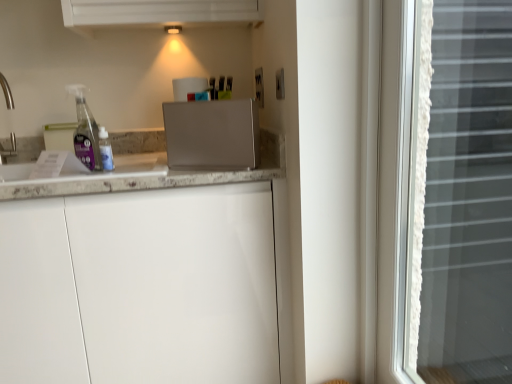
What do you see at coordinates (133, 176) in the screenshot?
I see `white marble countertop at left` at bounding box center [133, 176].

This screenshot has width=512, height=384. Describe the element at coordinates (140, 287) in the screenshot. I see `white matte cabinet at center` at that location.

Measure the distance between point (169, 236) and camera.

Point (169, 236) is 4.13 feet away from camera.

This screenshot has height=384, width=512. Identify the location of satin silver toaster at center. pyautogui.click(x=212, y=134).

Locate an element on the screen. countertop that is above the white matte cabinet at center (from the image's perspective) is located at coordinates (133, 176).

Is white matte cabinet at center not inside white marble countertop at left?

white matte cabinet at center lies outside white marble countertop at left's area.

Does point (272, 341) appear closer or farther from the camera than point (268, 173)?

Point (272, 341) appears to be farther away from the viewer than point (268, 173).

Which is behind, white matte cabinet at center or white marble countertop at left?

white marble countertop at left.

From a real-world perspective, is white lace curtain at right below white marble countertop at left?

Yes, from a real-world perspective, white lace curtain at right is under white marble countertop at left.

How many degrees apart are the facing directions of white lace curtain at right and white marble countertop at left?

They differ by 89.7 degrees in their facing directions.

Find the location of `countertop above the white lace curtain at right (from the image's perspective)`. countertop above the white lace curtain at right (from the image's perspective) is located at coordinates (133, 176).

Considering the relative positions of white lace curtain at right and white marble countertop at left in the image provided, is white lace curtain at right to the left or to the right of white marble countertop at left?

white lace curtain at right is to the right of white marble countertop at left.

Can you confirm if white matte cabinet at center is bigger than satin silver toaster at center?

Indeed, white matte cabinet at center has a larger size compared to satin silver toaster at center.

Is point (157, 284) in front of point (183, 165)?

That is True.

Is white marble countertop at left not near white lace curtain at right?

No.

From the image's perspective, is white marble countertop at left positioned above or below white lace curtain at right?

white marble countertop at left is above white lace curtain at right.

Between satin silver toaster at center and white lace curtain at right, which one has larger size?

Bigger between the two is white lace curtain at right.

Which point is more forward, (195, 110) or (442, 318)?

The point (195, 110) is in front.

Where is `window that appears below the satin silver toaster at center (from the image's perspective)`? window that appears below the satin silver toaster at center (from the image's perspective) is located at coordinates (448, 195).

Looking at this image, is white marble countertop at left facing away from white matte cabinet at center?

Yes, white marble countertop at left is facing away from white matte cabinet at center.

Is the depth of white marble countertop at left greater than that of white matte cabinet at center?

Yes, the depth of white marble countertop at left is greater than that of white matte cabinet at center.

Considering the relative sizes of white marble countertop at left and white matte cabinet at center in the image provided, is white marble countertop at left smaller than white matte cabinet at center?

Yes.

How far apart are white marble countertop at left and white matte cabinet at center?

white marble countertop at left is 10.87 inches away from white matte cabinet at center.

Who is bigger, white matte cabinet at center or white lace curtain at right?

With larger size is white matte cabinet at center.

In the scene shown: Does white matte cabinet at center touch white lace curtain at right?

No, white matte cabinet at center is not next to white lace curtain at right.

Looking at this image, measure the distance between white matte cabinet at center and white lace curtain at right.

white matte cabinet at center is 27.35 inches away from white lace curtain at right.

Does white matte cabinet at center have a greater height compared to white lace curtain at right?

Incorrect, the height of white matte cabinet at center is not larger of that of white lace curtain at right.

Identify the location of countertop behind the white matte cabinet at center. (133, 176).

Find the location of a particular element. This screenshot has height=384, width=512. countertop above the white lace curtain at right (from the image's perspective) is located at coordinates click(x=133, y=176).

Looking at the image, which one is located closer to satin silver toaster at center, white matte cabinet at center or white lace curtain at right?

white matte cabinet at center lies closer to satin silver toaster at center than the other object.

Looking at the image, which one is located closer to white marble countertop at left, white lace curtain at right or satin silver toaster at center?

Among the two, satin silver toaster at center is located nearer to white marble countertop at left.

Based on their spatial positions, is white marble countertop at left or white matte cabinet at center closer to white lace curtain at right?

white matte cabinet at center is closer to white lace curtain at right.

Considering their positions, is white marble countertop at left positioned closer to white matte cabinet at center than white lace curtain at right?

Among the two, white marble countertop at left is located nearer to white matte cabinet at center.

Based on their spatial positions, is satin silver toaster at center or white lace curtain at right further from white marble countertop at left?

white lace curtain at right lies further to white marble countertop at left than the other object.

Estimate the real-world distances between objects in this image. Which object is further from satin silver toaster at center, white lace curtain at right or white marble countertop at left?

white lace curtain at right.

Which object lies nearer to the anchor point white lace curtain at right, white matte cabinet at center or white marble countertop at left?

The object closer to white lace curtain at right is white matte cabinet at center.

Based on their spatial positions, is white marble countertop at left or satin silver toaster at center closer to white matte cabinet at center?

white marble countertop at left lies closer to white matte cabinet at center than the other object.

Identify the location of countertop between satin silver toaster at center and white matte cabinet at center in the vertical direction. The height and width of the screenshot is (384, 512). (133, 176).

Find the location of a particular element. This screenshot has width=512, height=384. appliance between white matte cabinet at center and white lace curtain at right from left to right is located at coordinates (212, 134).

In order to click on appliance between white marble countertop at left and white lace curtain at right in the horizontal direction in this screenshot , I will do `click(212, 134)`.

You are a GUI agent. You are given a task and a screenshot of the screen. Output one action in this format:
    pyautogui.click(x=<x>, y=<y>)
    Task: Click on the cabinetry between white marble countertop at left and white lace curtain at right
    The image size is (512, 384).
    Given the screenshot: What is the action you would take?
    pyautogui.click(x=140, y=287)